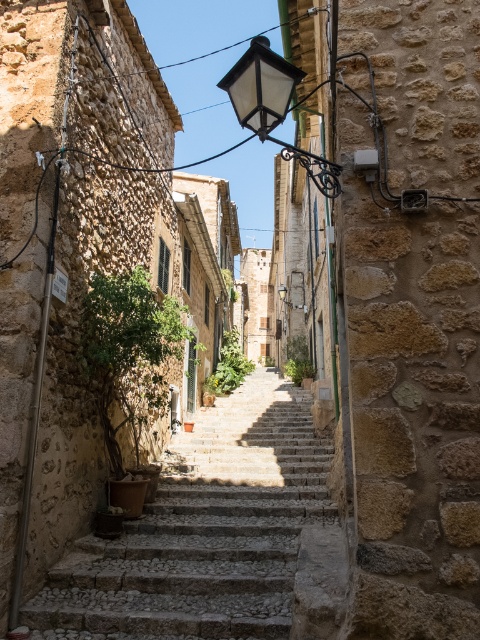
From the picture: Can you confirm if stone textured stairs at center is smaller than matte glass streetlamp at upper center?

Indeed, stone textured stairs at center has a smaller size compared to matte glass streetlamp at upper center.

This screenshot has height=640, width=480. Identify the location of stone textured stairs at center. (204, 531).